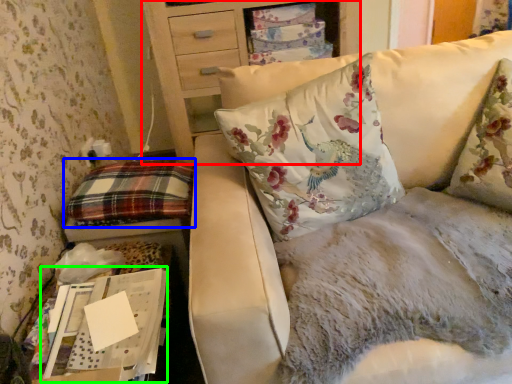
Question: Considering the real-world distances, which object is farthest from furniture (highlighted by a red box)? pillow (highlighted by a blue box) or cardboard box (highlighted by a green box)?

Choices:
 (A) pillow
 (B) cardboard box

Answer: (B)